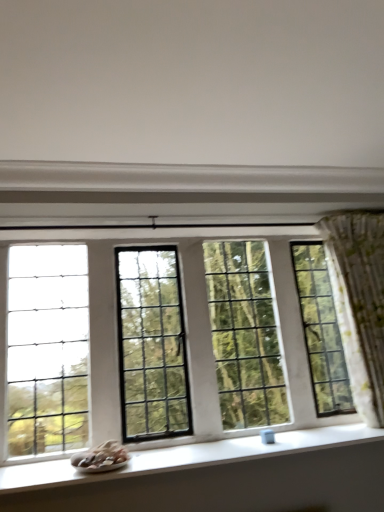
The image size is (384, 512). Describe the element at coordinates (193, 83) in the screenshot. I see `white matte wall at upper center` at that location.

In order to face white smooth window sill at lower center, should I rotate leftwards or rightwards?

You should look right and rotate roughly 4.264 degrees.

Describe the element at coordinates (187, 456) in the screenshot. I see `white smooth window sill at lower center` at that location.

This screenshot has width=384, height=512. In order to click on green floral fabric curtain at right in this screenshot , I will do `click(359, 302)`.

At what (x,y) coordinates should I click in order to perform the action: click on white matte wall at upper center. Please return your answer as a coordinate pair (x, y). Looking at the image, I should click on (193, 83).

Is white matte wall at upper center thinner than clear glass window at center?

No, white matte wall at upper center is not thinner than clear glass window at center.

Would you consider white matte wall at upper center to be distant from clear glass window at center?

white matte wall at upper center is actually quite close to clear glass window at center.

Find the location of a particular element. The image size is (384, 512). backdrop on the right of clear glass window at center is located at coordinates (193, 83).

From the image's perspective, would you say white matte wall at upper center is shown under clear glass window at center?

Incorrect, from the image's perspective, white matte wall at upper center is higher than clear glass window at center.

Would you say white matte wall at upper center is outside white smooth window sill at lower center?

white matte wall at upper center is positioned outside white smooth window sill at lower center.

Can you confirm if white matte wall at upper center is shorter than white smooth window sill at lower center?

In fact, white matte wall at upper center may be taller than white smooth window sill at lower center.

Based on the photo, is white matte wall at upper center next to white smooth window sill at lower center and touching it?

white matte wall at upper center and white smooth window sill at lower center are clearly separated.

From a real-world perspective, which is physically below, white matte wall at upper center or white smooth window sill at lower center?

white smooth window sill at lower center is physically lower.

Is white smooth window sill at lower center taller or shorter than white matte wall at upper center?

In the image, white smooth window sill at lower center appears to be shorter than white matte wall at upper center.

Is white smooth window sill at lower center thinner than white matte wall at upper center?

Yes, white smooth window sill at lower center is thinner than white matte wall at upper center.

From the image's perspective, which is above, white smooth window sill at lower center or white matte wall at upper center?

white matte wall at upper center is shown above in the image.

Is green floral fabric curtain at right facing away from white smooth window sill at lower center?

No, green floral fabric curtain at right is not facing away from white smooth window sill at lower center.

From the image's perspective, which is above, green floral fabric curtain at right or white smooth window sill at lower center?

green floral fabric curtain at right, from the image's perspective.

In the scene shown: Is green floral fabric curtain at right closer to camera compared to white smooth window sill at lower center?

No, it is behind white smooth window sill at lower center.

Locate an element on the screen. curtain on the right of white smooth window sill at lower center is located at coordinates (359, 302).

Considering the relative sizes of white smooth window sill at lower center and green floral fabric curtain at right in the image provided, is white smooth window sill at lower center bigger than green floral fabric curtain at right?

Actually, white smooth window sill at lower center might be smaller than green floral fabric curtain at right.

What's the angular difference between white smooth window sill at lower center and green floral fabric curtain at right's facing directions?

The angle between the facing direction of white smooth window sill at lower center and the facing direction of green floral fabric curtain at right is 0.877 degrees.

Is white smooth window sill at lower center far from green floral fabric curtain at right?

No, white smooth window sill at lower center is in close proximity to green floral fabric curtain at right.

Considering the sizes of objects white smooth window sill at lower center and clear glass window at center in the image provided, who is taller, white smooth window sill at lower center or clear glass window at center?

clear glass window at center.

Can we say white smooth window sill at lower center lies outside clear glass window at center?

Yes, white smooth window sill at lower center is not within clear glass window at center.

Measure the distance from white smooth window sill at lower center to clear glass window at center.

20.42 inches.

Would you consider clear glass window at center to be distant from white matte wall at upper center?

No, clear glass window at center is in close proximity to white matte wall at upper center.

Which of these two, clear glass window at center or white matte wall at upper center, is bigger?

Bigger between the two is clear glass window at center.

From the image's perspective, is clear glass window at center above white matte wall at upper center?

No.

Where is `backdrop in front of the clear glass window at center`? The height and width of the screenshot is (512, 384). backdrop in front of the clear glass window at center is located at coordinates (193, 83).

Locate an element on the screen. window sill behind the white matte wall at upper center is located at coordinates (187, 456).

Looking at the image, which one is located further to white smooth window sill at lower center, clear glass window at center or white matte wall at upper center?

white matte wall at upper center.

Looking at the image, which one is located further to white matte wall at upper center, white smooth window sill at lower center or green floral fabric curtain at right?

white smooth window sill at lower center lies further to white matte wall at upper center than the other object.

Looking at this image, estimate the real-world distances between objects in this image. Which object is closer to white matte wall at upper center, green floral fabric curtain at right or white smooth window sill at lower center?

green floral fabric curtain at right lies closer to white matte wall at upper center than the other object.

Considering their positions, is white smooth window sill at lower center positioned closer to white matte wall at upper center than clear glass window at center?

clear glass window at center is closer to white matte wall at upper center.

When comparing their distances from green floral fabric curtain at right, does clear glass window at center or white smooth window sill at lower center seem further?

Among the two, clear glass window at center is located further to green floral fabric curtain at right.

Based on their spatial positions, is clear glass window at center or green floral fabric curtain at right closer to white matte wall at upper center?

clear glass window at center is positioned closer to the anchor white matte wall at upper center.

Which object lies further to the anchor point clear glass window at center, white smooth window sill at lower center or green floral fabric curtain at right?

The object further to clear glass window at center is green floral fabric curtain at right.

From the picture: Considering their positions, is clear glass window at center positioned closer to white smooth window sill at lower center than green floral fabric curtain at right?

clear glass window at center is positioned closer to the anchor white smooth window sill at lower center.

Where is `curtain between white matte wall at upper center and white smooth window sill at lower center from top to bottom`? This screenshot has width=384, height=512. curtain between white matte wall at upper center and white smooth window sill at lower center from top to bottom is located at coordinates (359, 302).

Where is `window between white matte wall at upper center and white smooth window sill at lower center from top to bottom`? window between white matte wall at upper center and white smooth window sill at lower center from top to bottom is located at coordinates (176, 337).

Find the location of `window sill between clear glass window at center and green floral fabric curtain at right from left to right`. window sill between clear glass window at center and green floral fabric curtain at right from left to right is located at coordinates (187, 456).

This screenshot has width=384, height=512. I want to click on window between white matte wall at upper center and green floral fabric curtain at right along the z-axis, so click(x=176, y=337).